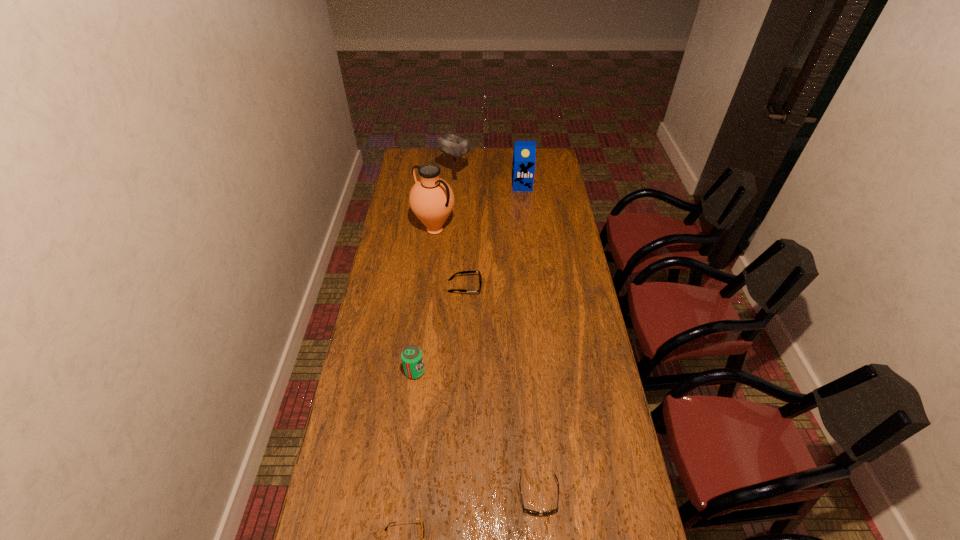
Find the location of a particular element. The height and width of the screenshot is (540, 960). pitcher is located at coordinates (431, 199).

Locate an element on the screen. The image size is (960, 540). mallet is located at coordinates (455, 146).

Where is `carton`? carton is located at coordinates (524, 154).

Where is `pop soda`? This screenshot has height=540, width=960. pop soda is located at coordinates (412, 358).

You are a GUI agent. You are given a task and a screenshot of the screen. Output one action in this format:
    pyautogui.click(x=<x>, y=<y>)
    Task: Click on the fourth tallest object
    
    Given the screenshot: What is the action you would take?
    pyautogui.click(x=412, y=358)

Image resolution: width=960 pixels, height=540 pixels. Find the location of `the fourth farthest object`. the fourth farthest object is located at coordinates (462, 272).

Find the location of a particular element. Image resolution: width=960 pixels, height=540 pixels. the farthest sunglasses is located at coordinates (462, 272).

At what (x,y) coordinates should I click in order to perform the action: click on the second nearest object. Please return your answer as a coordinate pair (x, y). The height and width of the screenshot is (540, 960). Looking at the image, I should click on (527, 510).

Identify the location of the rightmost sunglasses. The height and width of the screenshot is (540, 960). (527, 510).

What are the coordinates of `free space located on the front of the pitcher` in the screenshot? It's located at (426, 304).